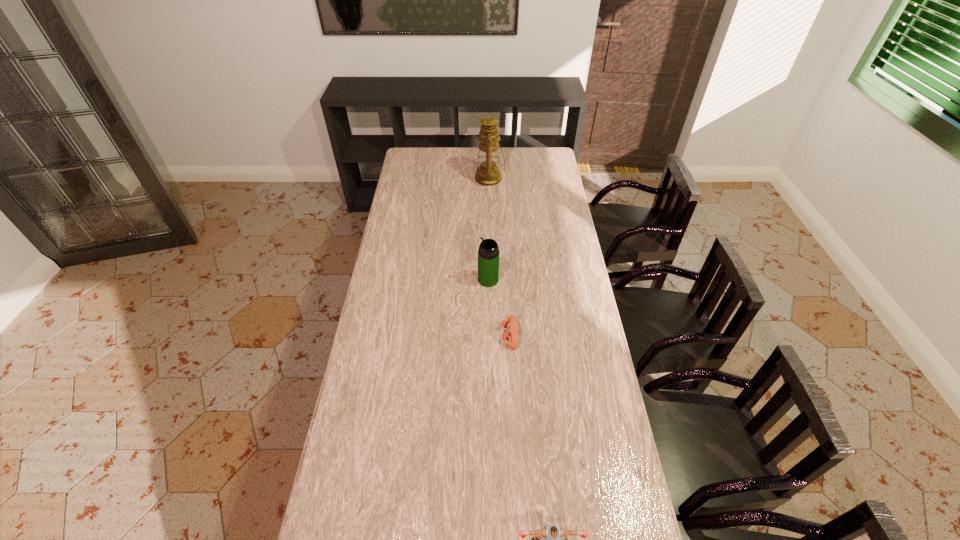
Where is `vacant area located 0.270m with the gloves of the shorter puncher facing forward`? vacant area located 0.270m with the gloves of the shorter puncher facing forward is located at coordinates (428, 335).

In order to click on free space located with the gloves of the shorter puncher facing forward in this screenshot , I will do `click(412, 335)`.

Find the location of a particular element. free space located with the gloves of the shorter puncher facing forward is located at coordinates (407, 335).

Locate an element on the screen. object situated at the far edge is located at coordinates (488, 174).

The height and width of the screenshot is (540, 960). I want to click on free spot at the far edge of the desktop, so click(x=470, y=148).

I want to click on vacant region at the left edge of the desktop, so click(415, 286).

The image size is (960, 540). I want to click on free spot at the right edge of the desktop, so click(x=599, y=384).

This screenshot has width=960, height=540. In the image, there is a desktop. What are the coordinates of `vacant space at the far right corner` in the screenshot? It's located at (554, 165).

This screenshot has height=540, width=960. I want to click on free spot between the tallest object and the third shortest object, so click(x=489, y=229).

You are a GUI agent. You are given a task and a screenshot of the screen. Output one action in this format:
    pyautogui.click(x=<x>, y=<y>)
    Task: Click on the free space between the farther puncher and the second farthest object
    
    Given the screenshot: What is the action you would take?
    pyautogui.click(x=499, y=307)